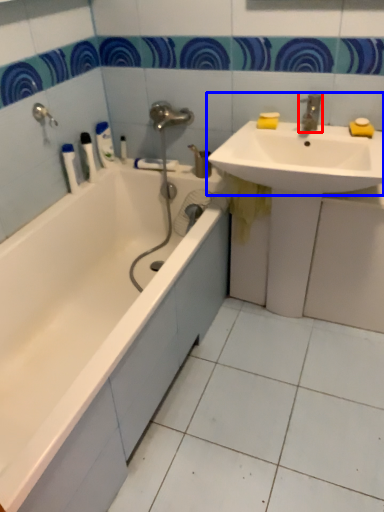
Question: Among these objects, which one is nearest to the camera, tap (highlighted by a red box) or sink (highlighted by a blue box)?

Choices:
 (A) tap
 (B) sink

Answer: (B)